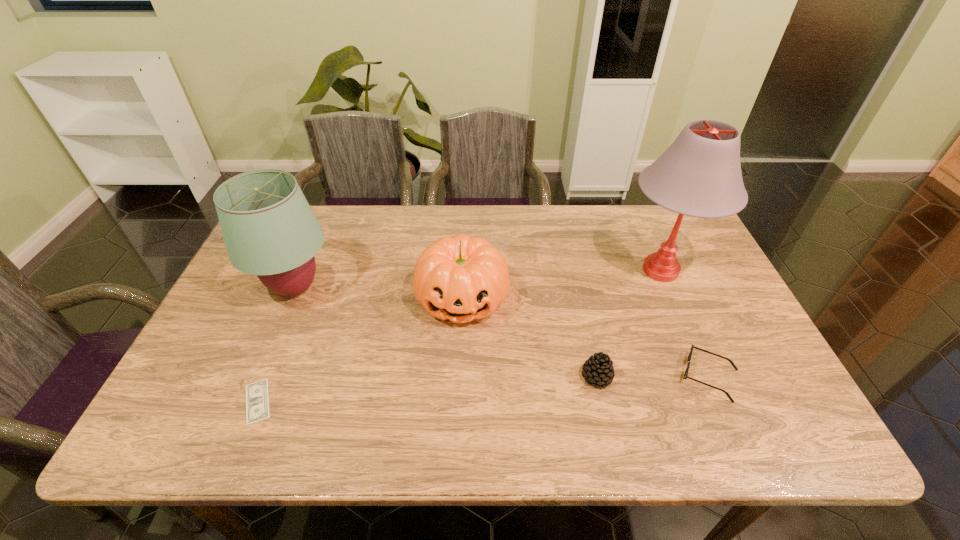
You are a GUI agent. You are given a task and a screenshot of the screen. Output one action in this format:
    pyautogui.click(x=<x>, y=<y>)
    Task: Click on the object that is positioned at the far edge
    This screenshot has height=540, width=960.
    Given the screenshot: What is the action you would take?
    pyautogui.click(x=699, y=175)

The image size is (960, 540). I want to click on object at the near edge, so tap(257, 398).

Locate an element on the screen. The height and width of the screenshot is (540, 960). lampshade located at the left edge is located at coordinates (269, 229).

You are a GUI agent. You are given a task and a screenshot of the screen. Output one action in this format:
    pyautogui.click(x=<x>, y=<y>)
    Task: Click on the money that is at the left edge
    This screenshot has width=960, height=540.
    Given the screenshot: What is the action you would take?
    pyautogui.click(x=257, y=398)

Identify the location of table lamp that is at the right edge. (699, 175).

Where is `sunglasses that is at the right edge`? This screenshot has width=960, height=540. sunglasses that is at the right edge is located at coordinates (685, 376).

Where is `object that is positioned at the near left corner`? The width and height of the screenshot is (960, 540). object that is positioned at the near left corner is located at coordinates (257, 398).

Where is `object situated at the far right corner`? The image size is (960, 540). object situated at the far right corner is located at coordinates (699, 175).

At what (x,y) coordinates should I click in order to perform the action: click on free space at the far edge of the desktop. Please return your answer as a coordinate pair (x, y). The height and width of the screenshot is (540, 960). Looking at the image, I should click on (560, 209).

In order to click on vacant space at the near edge of the desktop in this screenshot , I will do `click(655, 444)`.